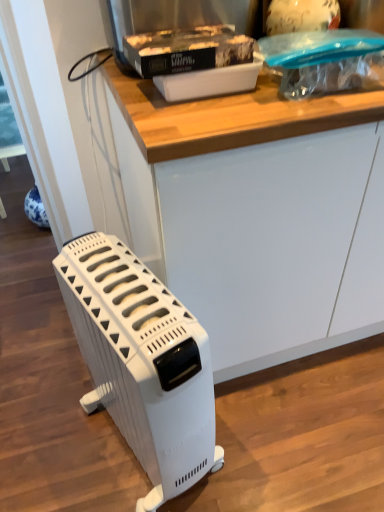
Identify the location of empty space that is ontop of white plastic heater at lower left (from a real-world perspective). (121, 290).